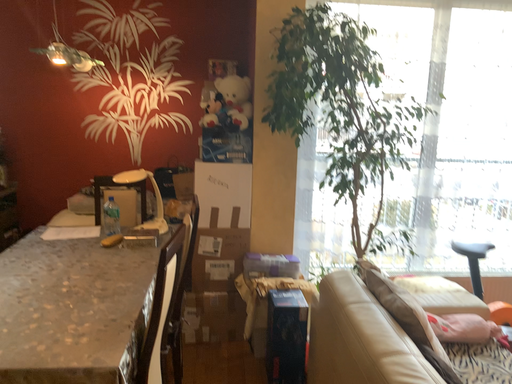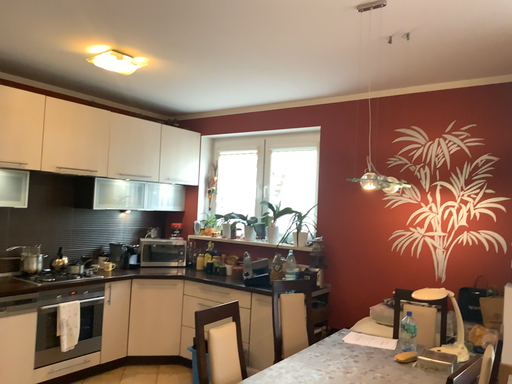
Question: Which way did the camera rotate in the video?

Choices:
 (A) rotated upward
 (B) rotated downward

Answer: (A)